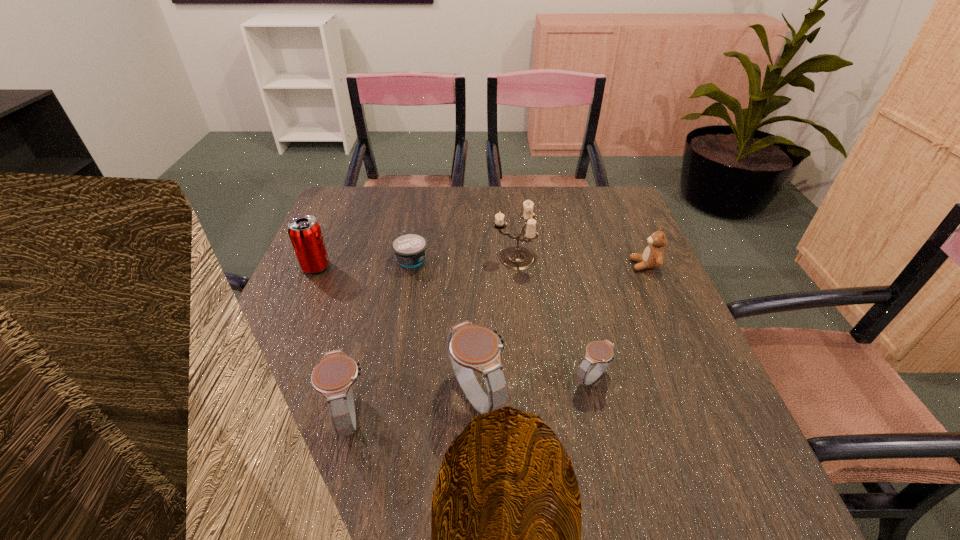
At what (x,y) coordinates should I click in order to perform the action: click on the leftmost watch. Please return your answer as a coordinate pair (x, y). The image size is (960, 540). Looking at the image, I should click on [x=333, y=377].

You are a GUI agent. You are given a task and a screenshot of the screen. Output one action in this format:
    pyautogui.click(x=<x>, y=<y>)
    Task: Click on the second watch from left to right
    
    Given the screenshot: What is the action you would take?
    pyautogui.click(x=470, y=347)

You are a GUI agent. You are given a task and a screenshot of the screen. Output one action in this format:
    pyautogui.click(x=<x>, y=<y>)
    Task: Click on the second shortest object
    The image size is (960, 540).
    Given the screenshot: What is the action you would take?
    pyautogui.click(x=601, y=353)

What are the coordinates of `the shortest watch` in the screenshot? It's located at (601, 353).

I want to click on the leftmost object, so click(304, 231).

Where is `the rightmost object`? The height and width of the screenshot is (540, 960). the rightmost object is located at coordinates (653, 256).

Locate an element on the screen. The height and width of the screenshot is (540, 960). the fifth tallest object is located at coordinates (653, 256).

Locate an element on the screen. The height and width of the screenshot is (540, 960). yogurt is located at coordinates (409, 248).

Locate an element on the screen. candle holder is located at coordinates (517, 257).

Locate an element on the screen. free spot located on the back of the leftmost watch is located at coordinates (387, 269).